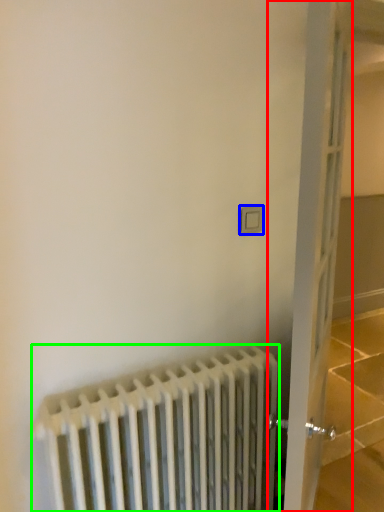
Question: Which object is the closest to the door (highlighted by a red box)? Choose among these: electric outlet (highlighted by a blue box) or radiator (highlighted by a green box).

Choices:
 (A) electric outlet
 (B) radiator

Answer: (B)